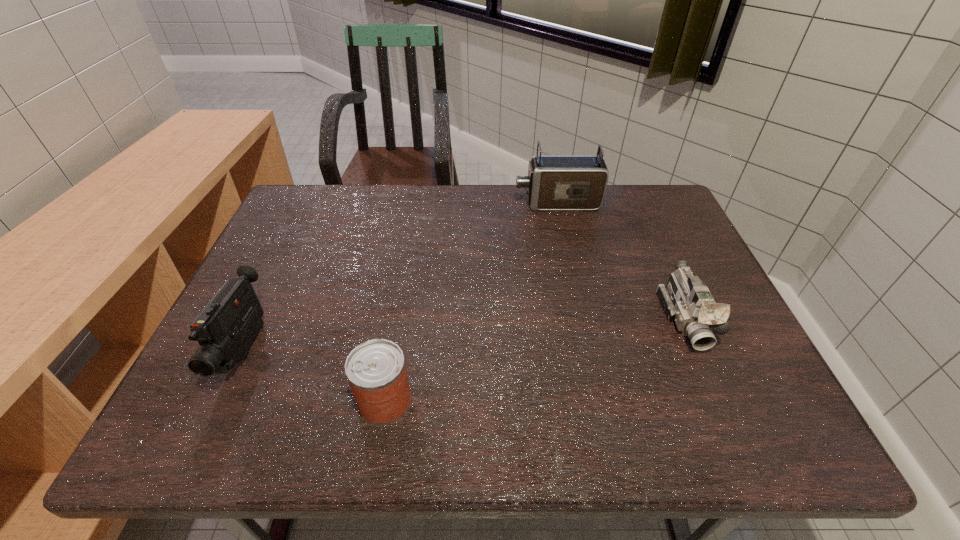
You are a GUI agent. You are given a task and a screenshot of the screen. Output one action in this format:
    pyautogui.click(x=<x>, y=<y>)
    Task: Click on the vacant region that satisfies the following two spatial constraints: 1. on the front-facing side of the leftmost object; 2. on the right side of the third object from right to left
    
    Given the screenshot: What is the action you would take?
    pyautogui.click(x=220, y=401)

What are the coordinates of `vacant space that satisfies the following two spatial constraints: 1. on the front-facing side of the leftmost camcorder; 2. on the left side of the third object from right to left` in the screenshot? It's located at (220, 401).